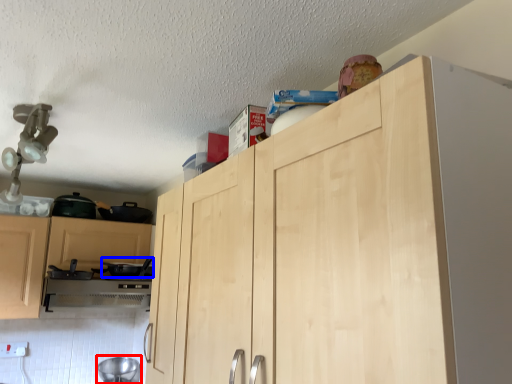
Question: Which object appears farthest to the camera in this image, appliance (highlighted by a red box) or appliance (highlighted by a blue box)?

Choices:
 (A) appliance
 (B) appliance

Answer: (A)